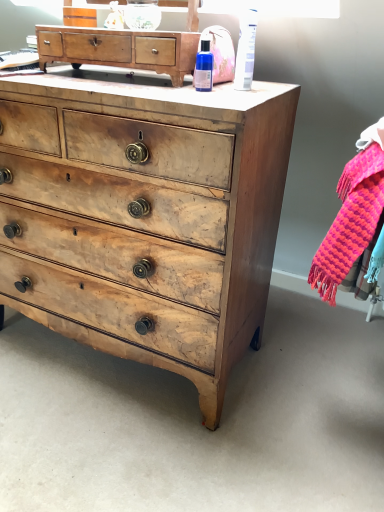
Question: Does knitted wool scarf at right have a lesser height compared to blue glass bottle at upper center, which ranks as the 1th toiletry in left-to-right order?

Choices:
 (A) yes
 (B) no

Answer: (B)

Question: Is knitted wool scarf at right taller than blue glass bottle at upper center, acting as the 2th toiletry starting from the right?

Choices:
 (A) yes
 (B) no

Answer: (A)

Question: From the image's perspective, is knitted wool scarf at right located above blue glass bottle at upper center, acting as the 2th toiletry starting from the right?

Choices:
 (A) yes
 (B) no

Answer: (B)

Question: Is knitted wool scarf at right facing away from blue glass bottle at upper center, which ranks as the 1th toiletry in left-to-right order?

Choices:
 (A) no
 (B) yes

Answer: (A)

Question: Does knitted wool scarf at right touch blue glass bottle at upper center, which ranks as the 1th toiletry in left-to-right order?

Choices:
 (A) yes
 (B) no

Answer: (B)

Question: Is knitted wool scarf at right at the right side of blue glass bottle at upper center, acting as the 2th toiletry starting from the right?

Choices:
 (A) yes
 (B) no

Answer: (A)

Question: Does knitted wool scarf at right have a lesser height compared to white plastic tube at upper right, the first toiletry positioned from the right?

Choices:
 (A) no
 (B) yes

Answer: (A)

Question: From a real-world perspective, is knitted wool scarf at right below white plastic tube at upper right, the first toiletry positioned from the right?

Choices:
 (A) no
 (B) yes

Answer: (B)

Question: Is knitted wool scarf at right further to camera compared to white plastic tube at upper right, arranged as the 2th toiletry when viewed from the left?

Choices:
 (A) no
 (B) yes

Answer: (A)

Question: Are knitted wool scarf at right and white plastic tube at upper right, arranged as the 2th toiletry when viewed from the left, beside each other?

Choices:
 (A) no
 (B) yes

Answer: (A)

Question: Is knitted wool scarf at right facing away from white plastic tube at upper right, arranged as the 2th toiletry when viewed from the left?

Choices:
 (A) no
 (B) yes

Answer: (A)

Question: Does knitted wool scarf at right come in front of white plastic tube at upper right, arranged as the 2th toiletry when viewed from the left?

Choices:
 (A) no
 (B) yes

Answer: (B)

Question: Is wooden chest of drawers at center, the 1th chest of drawers when ordered from bottom to top, positioned beyond the bounds of white plastic tube at upper right, the first toiletry positioned from the right?

Choices:
 (A) yes
 (B) no

Answer: (A)